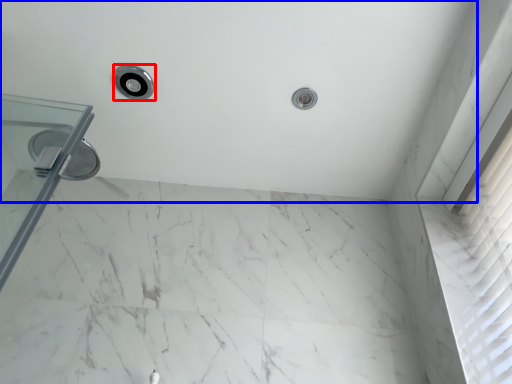
Question: Which of the following is the closest to the observer, shower (highlighted by a red box) or bath (highlighted by a blue box)?

Choices:
 (A) shower
 (B) bath

Answer: (B)